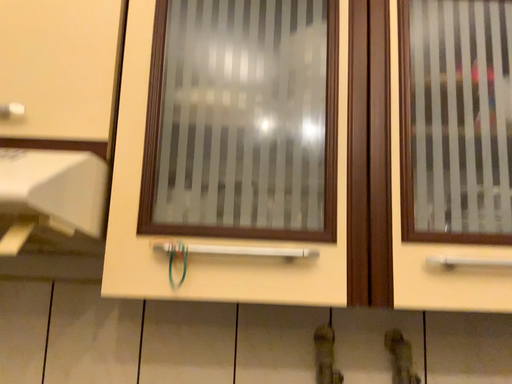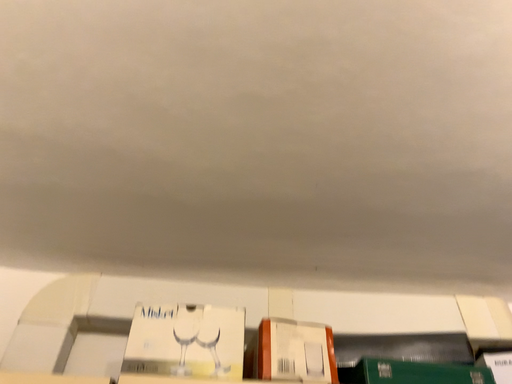
Question: How did the camera likely rotate when shooting the video?

Choices:
 (A) rotated downward
 (B) rotated upward

Answer: (B)